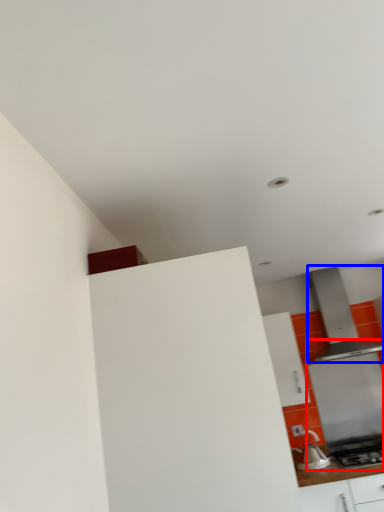
Question: Which point is further to the camera, appliance (highlighted by a red box) or home appliance (highlighted by a blue box)?

Choices:
 (A) appliance
 (B) home appliance

Answer: (A)